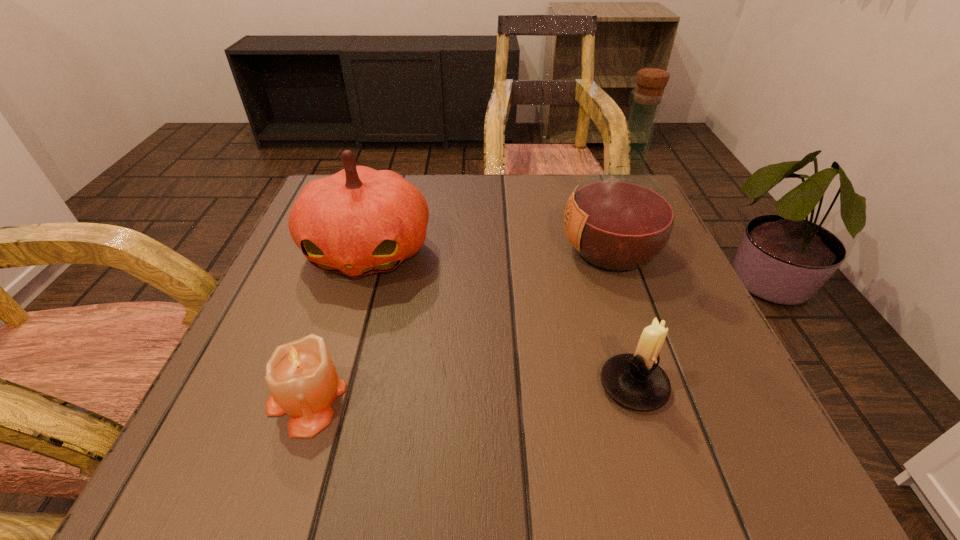
Find the location of a particular element. This screenshot has width=960, height=540. liquor that is at the far edge is located at coordinates (619, 219).

Locate an element on the screen. Image resolution: width=960 pixels, height=540 pixels. pumpkin that is at the far edge is located at coordinates (359, 221).

Find the location of a particular element. This screenshot has height=540, width=960. candle holder positioned at the near edge is located at coordinates (636, 381).

You are a GUI agent. You are given a task and a screenshot of the screen. Output one action in this format:
    pyautogui.click(x=<x>, y=<y>)
    Task: Click on the candle at the near edge
    
    Given the screenshot: What is the action you would take?
    click(301, 376)

The height and width of the screenshot is (540, 960). Find the location of `pumpkin positioned at the left edge`. pumpkin positioned at the left edge is located at coordinates (359, 221).

Locate an element on the screen. candle positioned at the left edge is located at coordinates (301, 376).

Locate an element on the screen. This screenshot has height=540, width=960. liquor that is at the right edge is located at coordinates coord(619,219).

At what (x,y) coordinates should I click in order to perform the action: click on candle holder present at the right edge. Please return your answer as a coordinate pair (x, y). The height and width of the screenshot is (540, 960). Looking at the image, I should click on (636, 381).

Identify the location of object at the far left corner. (359, 221).

Identify the location of object present at the near left corner. (301, 376).